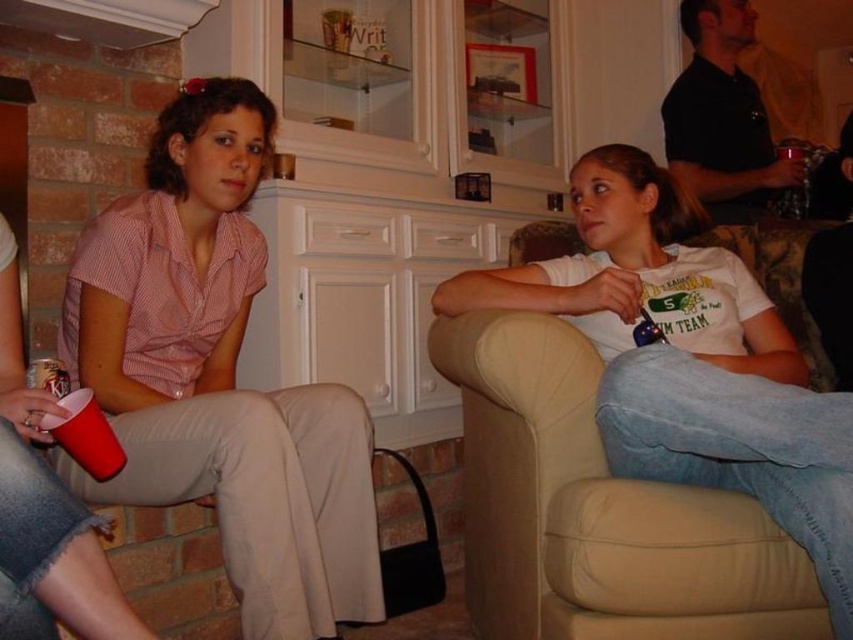
Who is lower down, pink cotton shirt at left or translucent glass cup at upper right?

Positioned lower is pink cotton shirt at left.

Can you confirm if pink cotton shirt at left is positioned below translucent glass cup at upper right?

Correct, pink cotton shirt at left is located below translucent glass cup at upper right.

Between point (309, 493) and point (798, 179), which one is positioned in front?

Positioned in front is point (309, 493).

The height and width of the screenshot is (640, 853). What are the coordinates of `pink cotton shirt at left` in the screenshot? It's located at (219, 376).

From the picture: Does beige leather couch at center appear on the right side of translucent glass cup at upper right?

Incorrect, beige leather couch at center is not on the right side of translucent glass cup at upper right.

Between point (741, 612) and point (787, 192), which one is positioned in front?

Point (741, 612)

This screenshot has width=853, height=640. I want to click on beige leather couch at center, so click(596, 509).

Who is lower down, pink cotton shirt at left or beige leather couch at center?

beige leather couch at center is below.

Between pink cotton shirt at left and beige leather couch at center, which one has more height?

Standing taller between the two is pink cotton shirt at left.

Is point (299, 620) behind point (654, 611)?

Yes, it is behind point (654, 611).

Find the location of a particular element. pink cotton shirt at left is located at coordinates tap(219, 376).